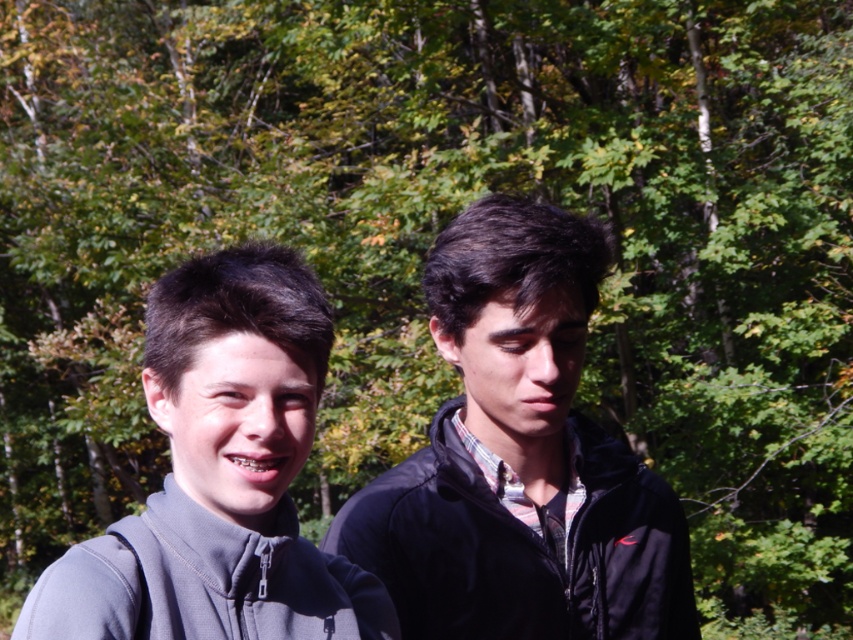
Question: Estimate the real-world distances between objects in this image. Which object is closer to the gray matte jacket at left?

Choices:
 (A) black matte jacket at center
 (B) gray fleece sweatshirt at lower left

Answer: (B)

Question: Estimate the real-world distances between objects in this image. Which object is closer to the gray fleece sweatshirt at lower left?

Choices:
 (A) gray matte jacket at left
 (B) black matte jacket at center

Answer: (A)

Question: In this image, where is black matte jacket at center located relative to gray fleece sweatshirt at lower left?

Choices:
 (A) above
 (B) below

Answer: (A)

Question: Is gray matte jacket at left further to camera compared to gray fleece sweatshirt at lower left?

Choices:
 (A) no
 (B) yes

Answer: (A)

Question: Can you confirm if gray matte jacket at left is wider than gray fleece sweatshirt at lower left?

Choices:
 (A) no
 (B) yes

Answer: (A)

Question: Which object is closer to the camera taking this photo?

Choices:
 (A) gray matte jacket at left
 (B) black matte jacket at center
 (C) gray fleece sweatshirt at lower left

Answer: (A)